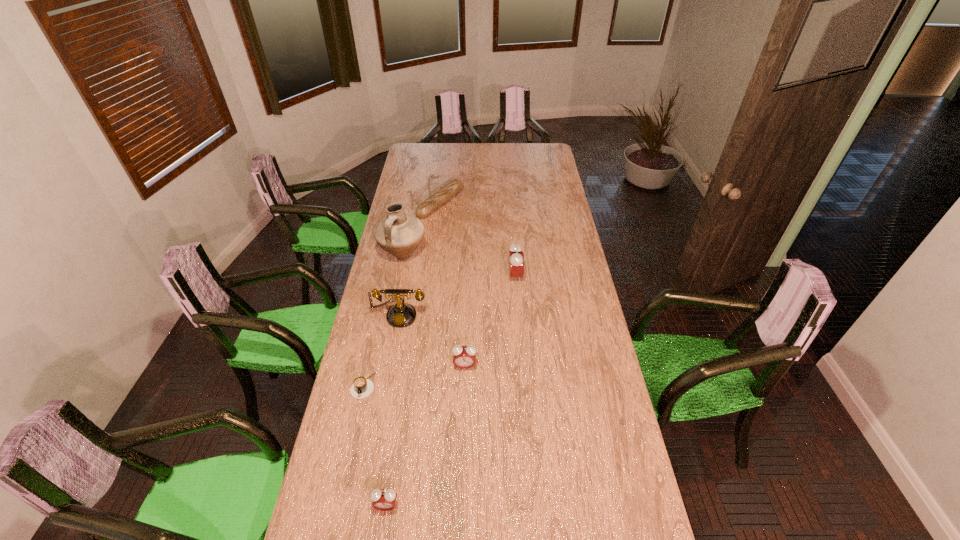
Locate an element on the screen. Image resolution: width=960 pixels, height=540 pixels. baguet is located at coordinates (433, 202).

Where is `the second shortest object`? The width and height of the screenshot is (960, 540). the second shortest object is located at coordinates tap(433, 202).

At what (x,y) coordinates should I click in order to perform the action: click on vacant space situated 0.090m on the clock face of the second nearest alarm clock. Please return your answer as a coordinate pair (x, y). The height and width of the screenshot is (540, 960). Looking at the image, I should click on click(x=464, y=393).

Identify the location of free region located 0.260m on the clock face of the tallest alarm clock. (581, 276).

Where is `free region located on the handle side of the tallest object`? free region located on the handle side of the tallest object is located at coordinates (396, 298).

At what (x,y) coordinates should I click in order to perform the action: click on free space located on the dial of the telephone. Please return your answer as a coordinate pair (x, y). This screenshot has height=540, width=960. Looking at the image, I should click on (390, 373).

The image size is (960, 540). I want to click on vacant region located 0.190m with the handle on the side of the cappuccino, so click(x=348, y=454).

Where is `vacant space located on the back of the farthest object`? Image resolution: width=960 pixels, height=540 pixels. vacant space located on the back of the farthest object is located at coordinates (445, 161).

Image resolution: width=960 pixels, height=540 pixels. What are the coordinates of `object at the near edge` in the screenshot? It's located at (383, 499).

The width and height of the screenshot is (960, 540). I want to click on pitcher that is at the left edge, so click(399, 234).